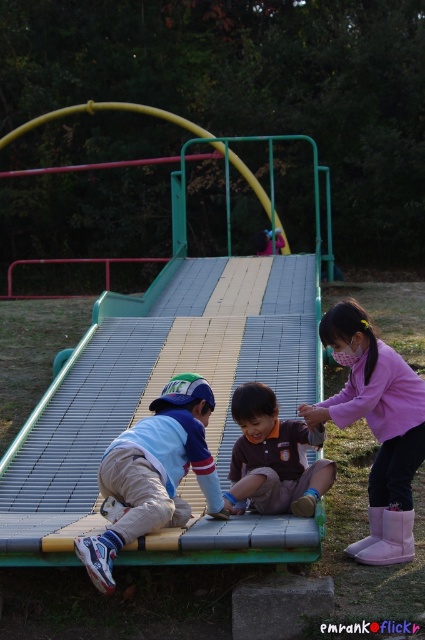
You are a photographer taking a picture of the playground scene. You want to ensure both the pink fabric mask at upper right and the brown fabric shirt at center are visible in your shot. Based on their positions, which object should you focus on first to capture both in the frame?

The pink fabric mask at upper right is located above the brown fabric shirt at center, so you should focus on the brown fabric shirt at center first to ensure both are in the frame.

You are standing at the green ramp with yellow accents in the playground. There are two points marked as point 1 at coordinates [173,468] and point 2 at coordinates [235,506]. Which point is closer to you?

Point 1 at coordinates [173,468] is closer to you because it is in front of point 2 at coordinates [235,506].